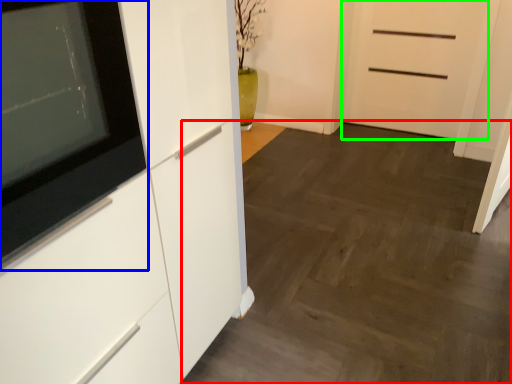
Question: Which object is the closest to the plain (highlighted by a red box)? Choose among these: appliance (highlighted by a blue box) or door (highlighted by a green box).

Choices:
 (A) appliance
 (B) door

Answer: (B)